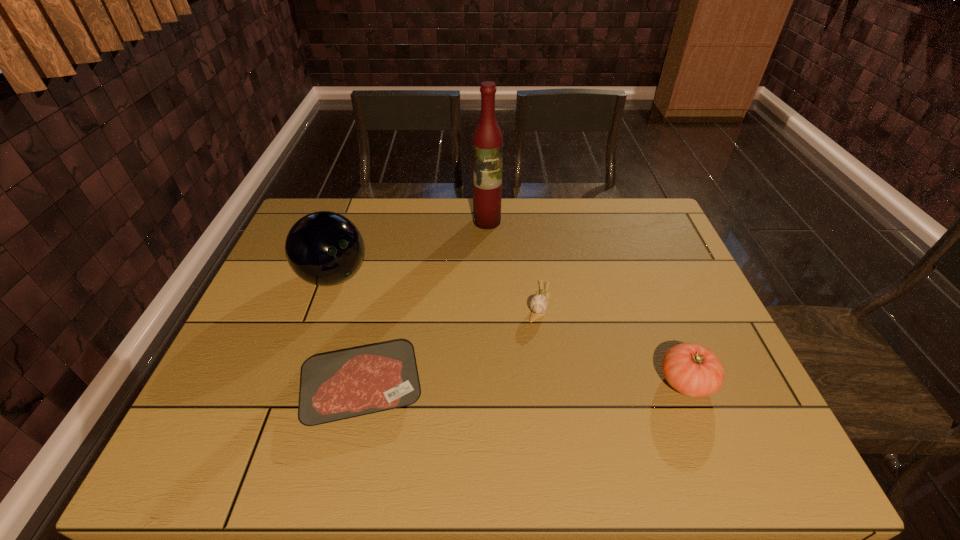
Find the location of a particular element. The width and height of the screenshot is (960, 540). object that is the second closest one to the bowling ball is located at coordinates (487, 143).

Locate an element on the screen. vacant space that satisfies the following two spatial constraints: 1. on the front side of the second object from right to left; 2. on the left side of the tomato is located at coordinates [550, 382].

Identify the location of vacant space that satisfies the following two spatial constraints: 1. on the back side of the tomato; 2. on the left side of the steak. (364, 382).

Where is `blank area in the image that satisfies the following two spatial constraints: 1. on the front side of the third shortest object; 2. on the left side of the bowling ball`? The width and height of the screenshot is (960, 540). blank area in the image that satisfies the following two spatial constraints: 1. on the front side of the third shortest object; 2. on the left side of the bowling ball is located at coordinates (x=297, y=382).